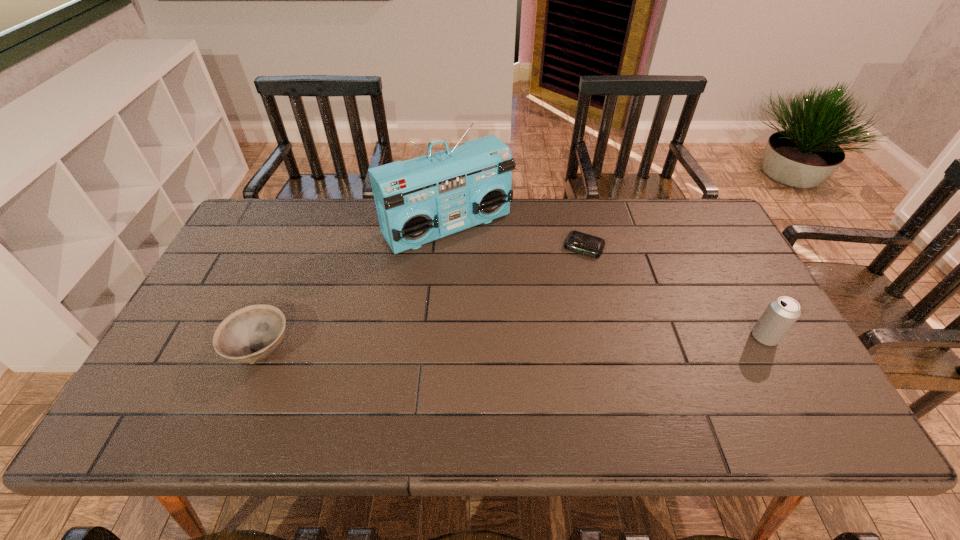
Find the location of a particular element. Image resolution: width=960 pixels, height=540 pixels. free space on the desktop that is between the bowl and the rightmost object and is positioned on the display of the alarm clock is located at coordinates (540, 342).

Where is `free space on the desktop that is between the third tallest object and the second tallest object and is positioned on the front-facing side of the third object from right to left`? free space on the desktop that is between the third tallest object and the second tallest object and is positioned on the front-facing side of the third object from right to left is located at coordinates (540, 342).